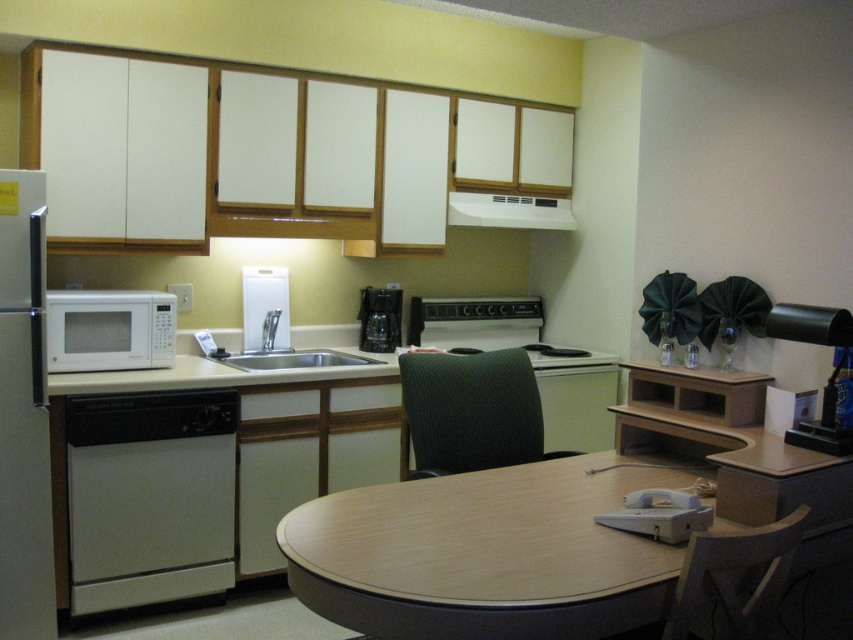
You are trying to fit a new appliance into the kitchenette. The white matte refrigerator at left and the white matte microwave at left are both on the left side. Which appliance takes up less horizontal space?

The white matte refrigerator at left has a lesser width compared to the white matte microwave at left, so it takes up less horizontal space.

You are standing in the hotel room kitchenette and want to place a small vase on the wooden table at center. The point you are aiming for is at coordinates point (x=483, y=554). Is this point on the wooden table at center?

Yes, the point (x=483, y=554) is on the wooden table at center, so placing the vase there would be appropriate.

You are a delivery person who needs to place a 1.5 meter long package between the white matte refrigerator at left and the white plastic faucet at center. Can you fit the package horizontally between them without moving either object?

The distance between the white matte refrigerator at left and the white plastic faucet at center is 1.24 meters. Since the package is 1.5 meters long, it cannot fit horizontally between them as the space is shorter than the package length.